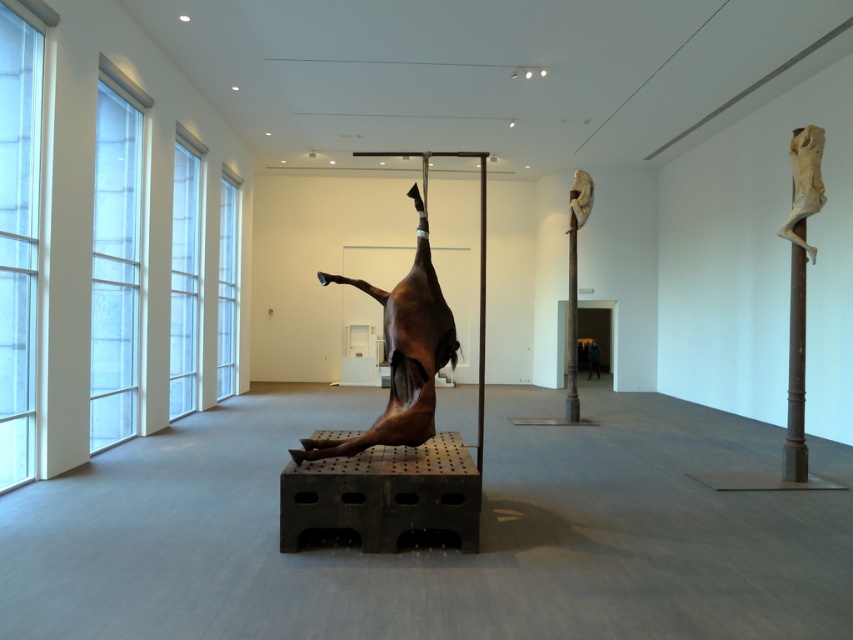
Question: Can you confirm if shiny bronze horse at center is smaller than matte white figure at right?

Choices:
 (A) yes
 (B) no

Answer: (B)

Question: Which object is positioned farthest from the matte white figure at right?

Choices:
 (A) shiny bronze horse at center
 (B) dark blue jacket at center

Answer: (B)

Question: Which point is closer to the camera?

Choices:
 (A) dark blue jacket at center
 (B) matte white figure at right

Answer: (B)

Question: Can you confirm if matte white figure at right is bigger than dark blue jacket at center?

Choices:
 (A) no
 (B) yes

Answer: (A)

Question: Does shiny bronze horse at center come behind matte white figure at right?

Choices:
 (A) no
 (B) yes

Answer: (A)

Question: Which of the following is the farthest from the observer?

Choices:
 (A) (815, 253)
 (B) (593, 346)
 (C) (305, 456)

Answer: (B)